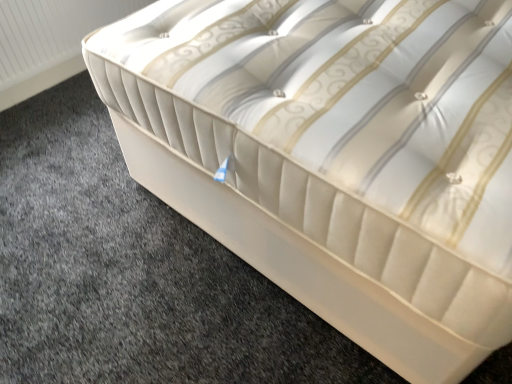
Where is `white glossy radiator at upper left`? white glossy radiator at upper left is located at coordinates 50,34.

What do you see at coordinates (50, 34) in the screenshot?
I see `white glossy radiator at upper left` at bounding box center [50, 34].

Find the location of a particular element. white glossy radiator at upper left is located at coordinates (50, 34).